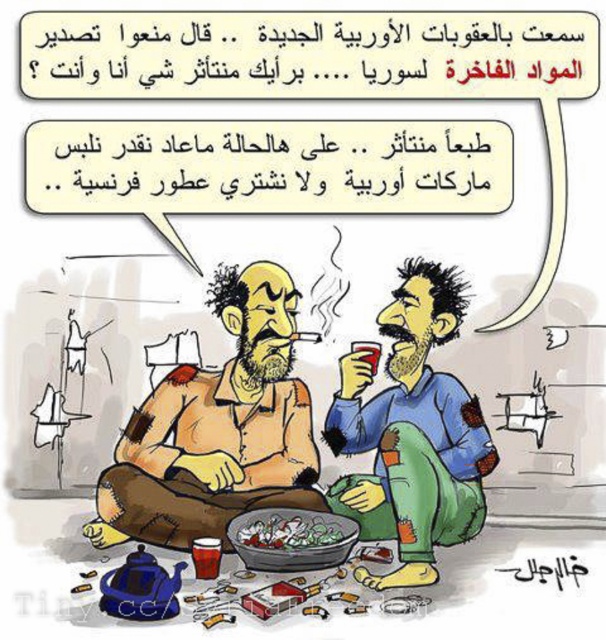
Is brown leather jacket at center to the right of green leafy vegetables at center from the viewer's perspective?

No, brown leather jacket at center is not to the right of green leafy vegetables at center.

Who is positioned more to the right, brown leather jacket at center or green leafy vegetables at center?

green leafy vegetables at center is more to the right.

Who is more distant from viewer, (267,406) or (255,515)?

Positioned behind is point (267,406).

Identify the location of brown leather jacket at center. 218,429.

Is the position of green patchwork pants at lower right more distant than that of green leafy vegetables at center?

No, it is in front of green leafy vegetables at center.

Does point (356, 388) come in front of point (315, 515)?

No, (356, 388) is behind (315, 515).

The width and height of the screenshot is (606, 640). In order to click on green patchwork pants at lower right in this screenshot , I will do `click(411, 433)`.

Which of these two, brown leather jacket at center or green patchwork pants at lower right, stands taller?

green patchwork pants at lower right is taller.

Is brown leather jacket at center below green patchwork pants at lower right?

Indeed, brown leather jacket at center is positioned under green patchwork pants at lower right.

Is point (264, 330) positioned in front of point (458, 435)?

No, (264, 330) is behind (458, 435).

You are a GUI agent. You are given a task and a screenshot of the screen. Output one action in this format:
    pyautogui.click(x=<x>, y=<y>)
    Task: Click on the brown leather jacket at center
    This screenshot has width=606, height=640.
    Given the screenshot: What is the action you would take?
    pyautogui.click(x=218, y=429)